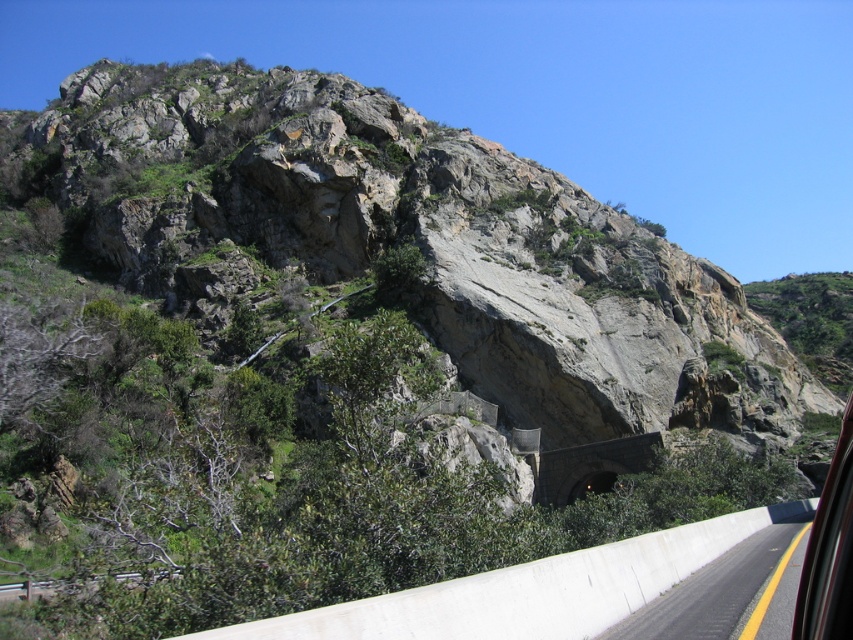
Question: Can you confirm if white concrete barrier at lower right is smaller than transparent glass car window at right?

Choices:
 (A) yes
 (B) no

Answer: (A)

Question: Can you confirm if white concrete barrier at lower right is positioned to the left of transparent glass car window at right?

Choices:
 (A) yes
 (B) no

Answer: (A)

Question: Which point appears closest to the camera in this image?

Choices:
 (A) (849, 513)
 (B) (735, 605)

Answer: (A)

Question: From the image, what is the correct spatial relationship of white concrete barrier at lower right in relation to transparent glass car window at right?

Choices:
 (A) above
 (B) below

Answer: (B)